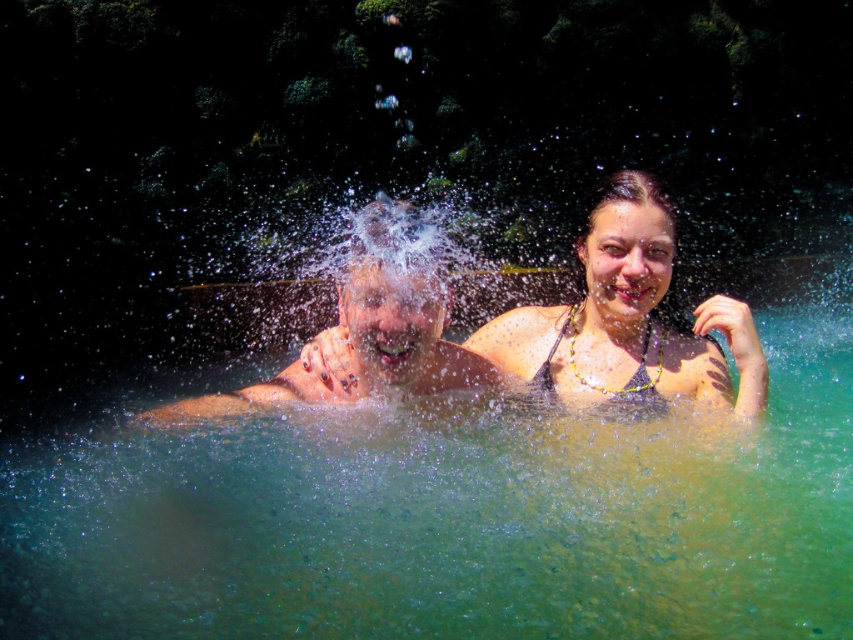
Question: Can you confirm if multicolored beaded necklace at upper right is positioned below black textured bikini top at center?

Choices:
 (A) yes
 (B) no

Answer: (B)

Question: Which point is farther to the camera?

Choices:
 (A) (642, 336)
 (B) (496, 374)
 (C) (647, 252)

Answer: (A)

Question: Which of the following is the farthest from the observer?

Choices:
 (A) (642, 369)
 (B) (614, 218)
 (C) (306, 365)

Answer: (A)

Question: Does multicolored beaded necklace at upper right appear on the left side of black textured bikini top at center?

Choices:
 (A) no
 (B) yes

Answer: (A)

Question: Based on their relative distances, which object is nearer to the smooth skin child at center?

Choices:
 (A) black textured bikini top at center
 (B) multicolored beaded necklace at upper right

Answer: (B)

Question: Does multicolored beaded necklace at upper right have a larger size compared to black textured bikini top at center?

Choices:
 (A) yes
 (B) no

Answer: (A)